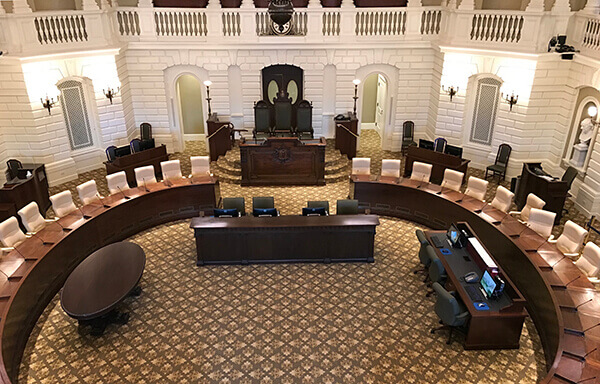
Where is `door`? The height and width of the screenshot is (384, 600). door is located at coordinates click(378, 107).